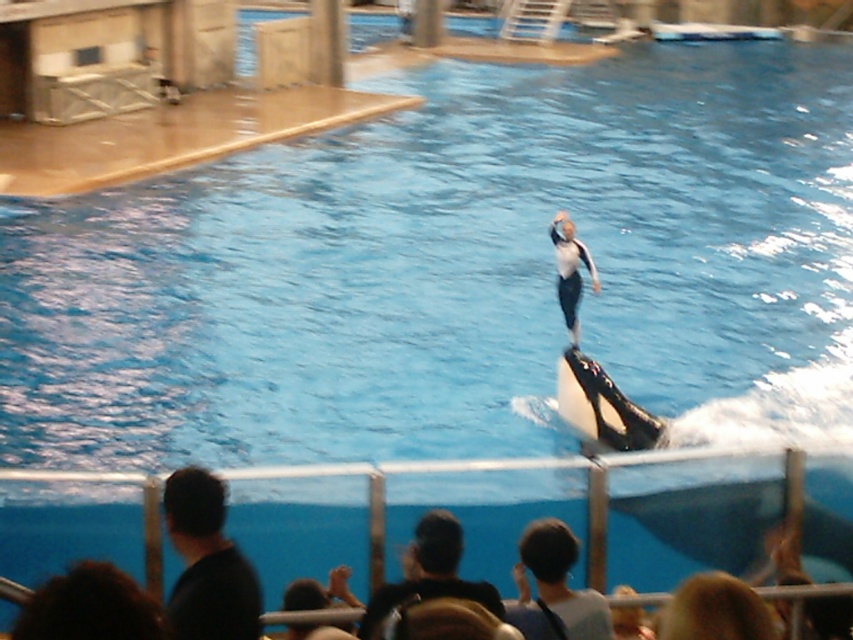
Can you confirm if black matte wetsuit at lower left is positioned below white matte wetsuit at center?

Yes.

Is point (196, 486) farther from viewer compared to point (576, 346)?

No, it is in front of (576, 346).

The width and height of the screenshot is (853, 640). Find the location of `black matte wetsuit at lower left`. black matte wetsuit at lower left is located at coordinates (207, 563).

At what (x,y) coordinates should I click in order to perform the action: click on blonde hair at lower right. Please return your answer as a coordinate pair (x, y). Looking at the image, I should click on (715, 611).

Which is behind, point (738, 604) or point (572, 337)?

Point (572, 337)

The height and width of the screenshot is (640, 853). I want to click on blonde hair at lower right, so click(715, 611).

Which is behind, point (103, 580) or point (453, 557)?

The point (453, 557) is behind.

Can you confirm if brown hair at lower left is thinner than dark blue hair at lower center?

Indeed, brown hair at lower left has a lesser width compared to dark blue hair at lower center.

Between point (86, 604) and point (424, 579), which one is positioned in front?

Point (86, 604)

Identify the location of brown hair at lower left. (90, 608).